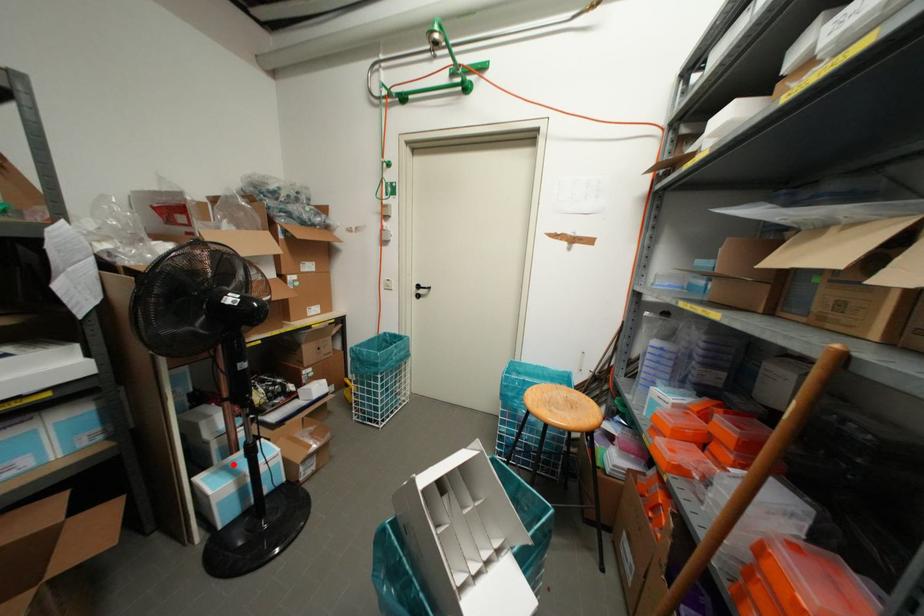
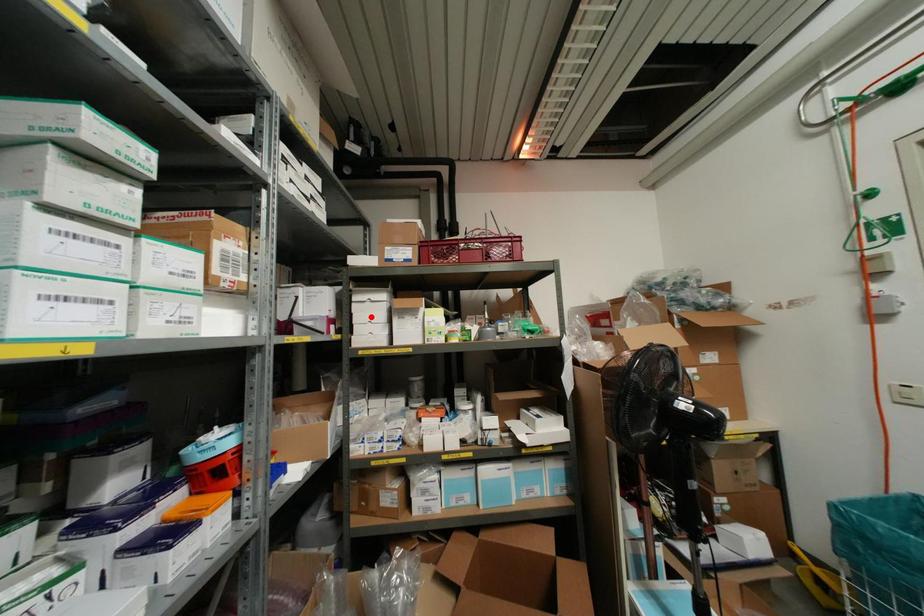
I am providing you with two images of the same scene from different viewpoints. A red point is marked on the first image and another point is marked on the second image. Is the marked point in image1 the same physical position as the marked point in image2?

No